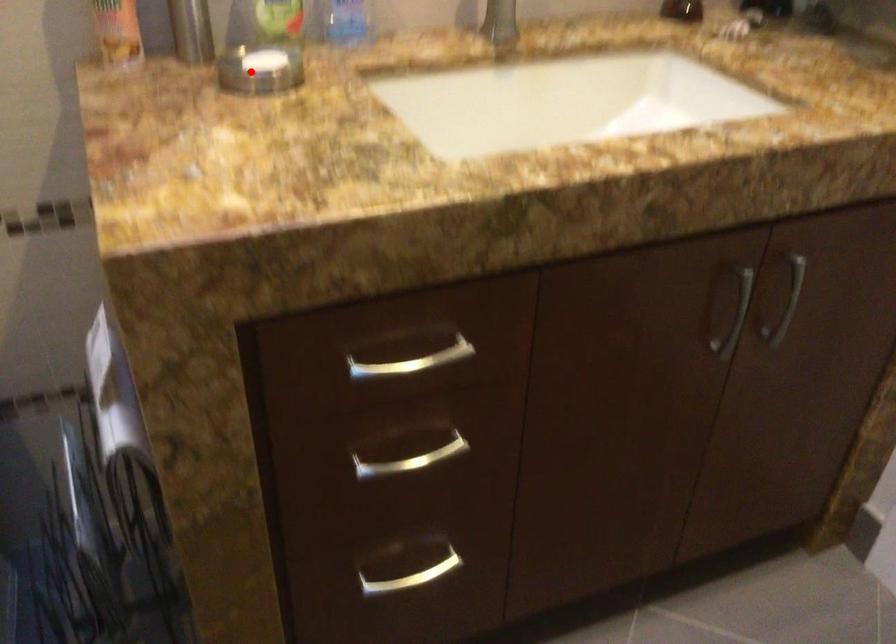
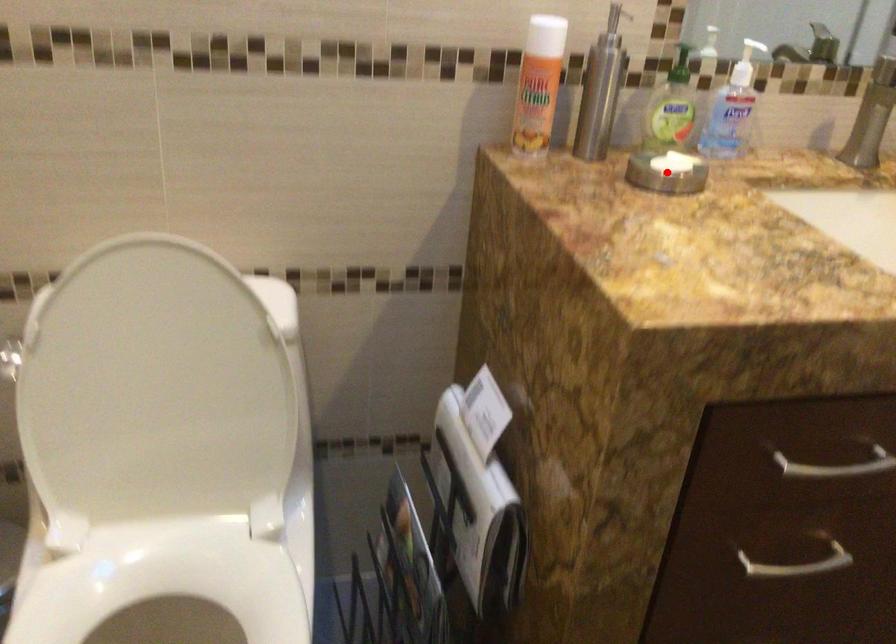
I am providing you with two images of the same scene from different viewpoints. A red point is marked on the first image and another point is marked on the second image. Do the highlighted points in image1 and image2 indicate the same real-world spot?

Yes